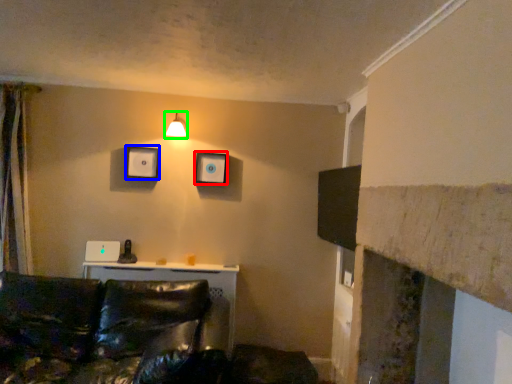
Question: Which object is the farthest from picture frame (highlighted by a red box)? Choose among these: picture frame (highlighted by a blue box) or light fixture (highlighted by a green box).

Choices:
 (A) picture frame
 (B) light fixture

Answer: (A)